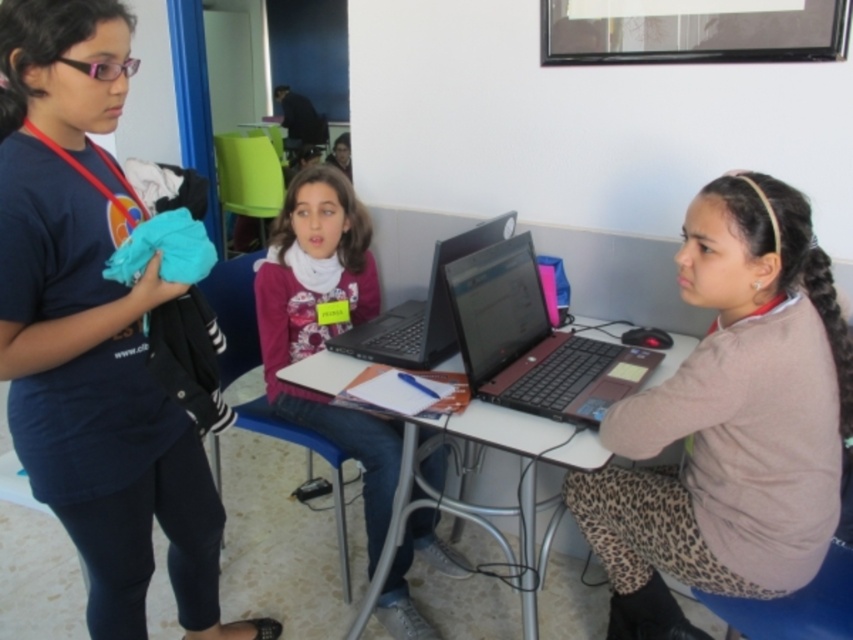
Question: Which object is the closest to the matte black laptop at center?

Choices:
 (A) leopard print sweater at center
 (B) black matte laptop at center

Answer: (B)

Question: Considering the relative positions of matte pink sweater at center and black matte laptop at center in the image provided, where is matte pink sweater at center located with respect to black matte laptop at center?

Choices:
 (A) left
 (B) right

Answer: (A)

Question: Can you confirm if matte blue shirt at left is positioned to the left of matte black laptop at center?

Choices:
 (A) yes
 (B) no

Answer: (A)

Question: Which of these objects is positioned farthest from the black matte laptop at center?

Choices:
 (A) matte black laptop at center
 (B) matte blue shirt at left
 (C) matte pink sweater at center

Answer: (B)

Question: Which point is farther from the camera taking this photo?

Choices:
 (A) (372, 467)
 (B) (454, 340)

Answer: (A)

Question: Does matte black laptop at center appear over matte plastic table at center?

Choices:
 (A) no
 (B) yes

Answer: (B)